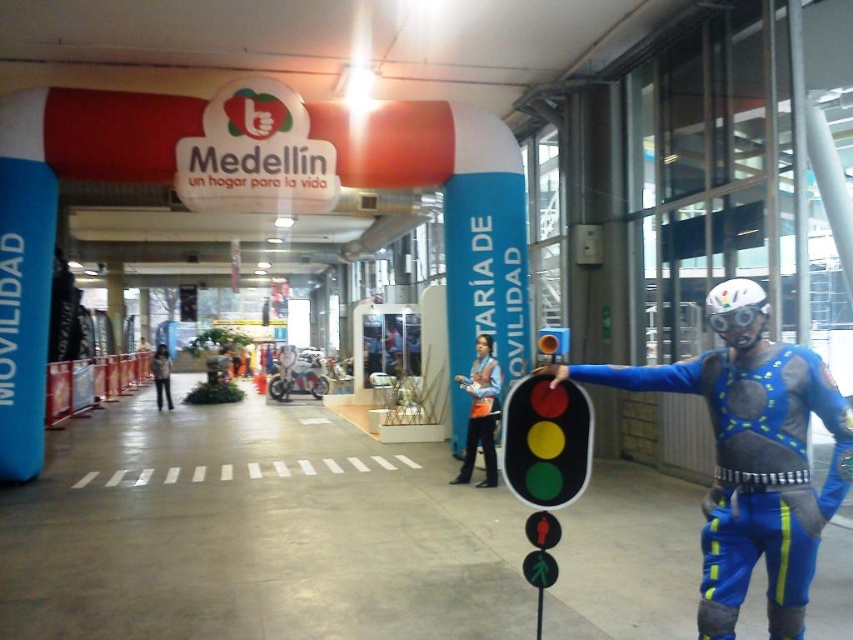
Question: Among these points, which one is farthest from the camera?

Choices:
 (A) (788, 424)
 (B) (491, 406)
 (C) (161, 344)

Answer: (C)

Question: From the image, what is the correct spatial relationship of blue fabric costume at center in relation to orange safety vest at center?

Choices:
 (A) below
 (B) above

Answer: (B)

Question: Considering the real-world distances, which object is farthest from the blue fabric costume at center?

Choices:
 (A) denim jacket at center
 (B) orange safety vest at center

Answer: (A)

Question: Does orange safety vest at center appear under denim jacket at center?

Choices:
 (A) no
 (B) yes

Answer: (A)

Question: Does blue fabric costume at center have a greater width compared to orange safety vest at center?

Choices:
 (A) no
 (B) yes

Answer: (B)

Question: Which object appears closest to the camera in this image?

Choices:
 (A) orange safety vest at center
 (B) blue fabric costume at center

Answer: (B)